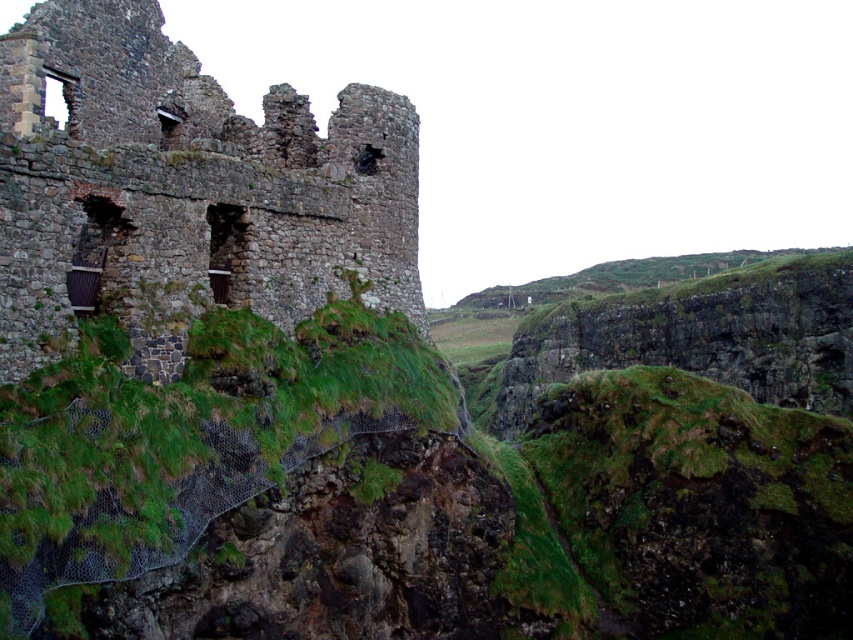
You are a maintenance worker tasked with repairing the rusty stone castle at upper left. You have a 7.5 meter long rope. If you need to lower yourself from the castle to the green grass at center, will the rope be long enough?

The rusty stone castle at upper left is 7.33 meters from the green grass at center. Since the rope is 7.5 meters long, it is slightly longer than the distance required. Therefore, the rope will be sufficient to lower yourself from the rusty stone castle at upper left to the green grass at center.

You are standing at the edge of the ancient stone structure and want to move towards the metal mesh barrier. Which point, point [108,92] or point [99,326], is closer to you?

Point [99,326] is closer to you because it is in front of point [108,92].